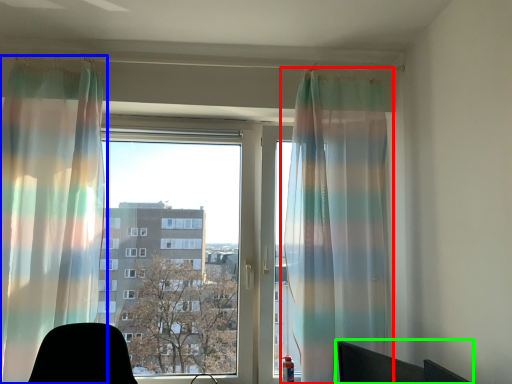
Question: Which object is the farthest from curtain (highlighted by a red box)? Choose among these: curtain (highlighted by a blue box) or computer chair (highlighted by a green box).

Choices:
 (A) curtain
 (B) computer chair

Answer: (A)